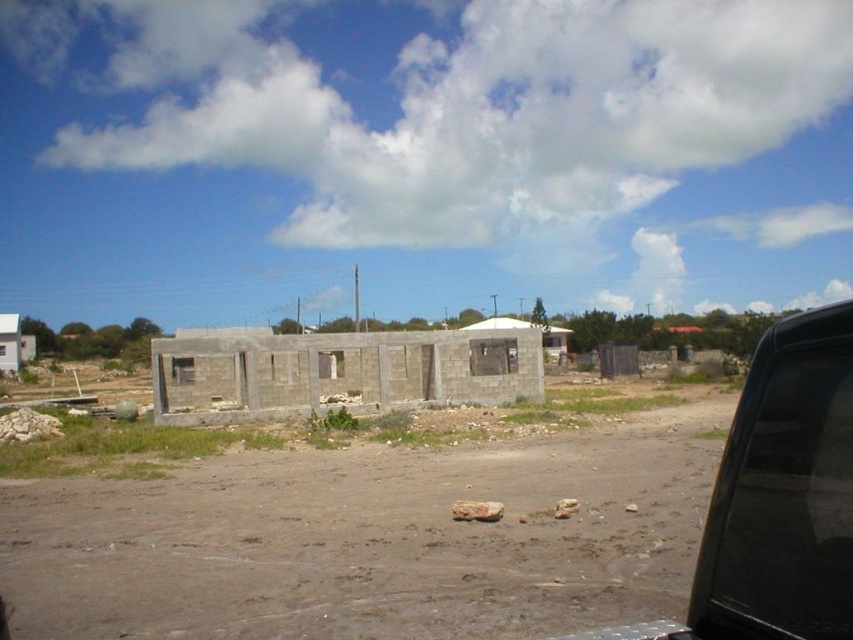
Question: Is brown dirt track at center to the left of black matte car at right from the viewer's perspective?

Choices:
 (A) no
 (B) yes

Answer: (B)

Question: Which point is closer to the camera?

Choices:
 (A) white concrete hut at lower left
 (B) black matte car at right

Answer: (B)

Question: Which point is farther to the camera?

Choices:
 (A) white concrete hut at lower left
 (B) gray concrete wall at center

Answer: (A)

Question: Considering the real-world distances, which object is closest to the gray concrete hut at center?

Choices:
 (A) white concrete hut at lower left
 (B) black matte car at right

Answer: (B)

Question: Can you confirm if gray concrete wall at center is thinner than white concrete hut at lower left?

Choices:
 (A) yes
 (B) no

Answer: (B)

Question: Is brown dirt track at center to the right of gray concrete wall at center from the viewer's perspective?

Choices:
 (A) yes
 (B) no

Answer: (A)